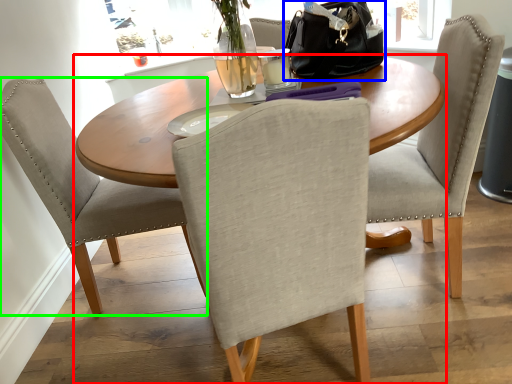
Question: Which object is the closest to the kitchen & dining room table (highlighted by a red box)? Choose among these: handbag (highlighted by a blue box) or chair (highlighted by a green box).

Choices:
 (A) handbag
 (B) chair

Answer: (B)